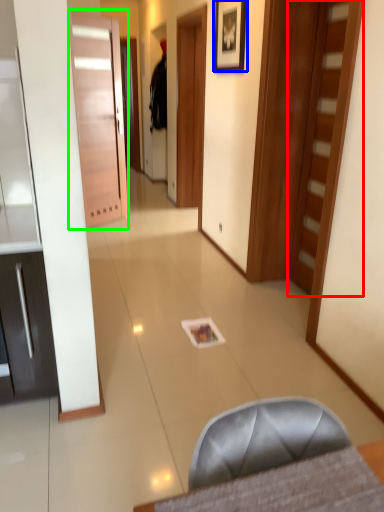
Question: Which object is the closest to the door (highlighted by a red box)? Choose among these: picture frame (highlighted by a blue box) or door (highlighted by a green box).

Choices:
 (A) picture frame
 (B) door

Answer: (A)